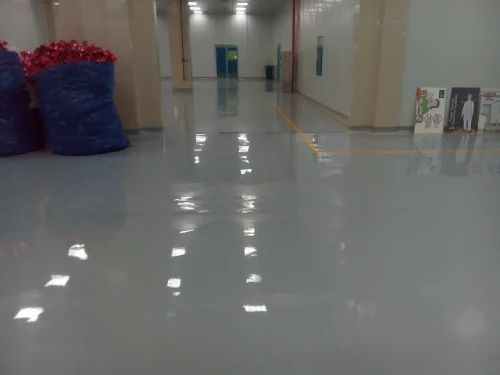
Locate an element on the screen. The image size is (500, 375). lights is located at coordinates (244, 3), (240, 7), (196, 8), (196, 13), (195, 1).